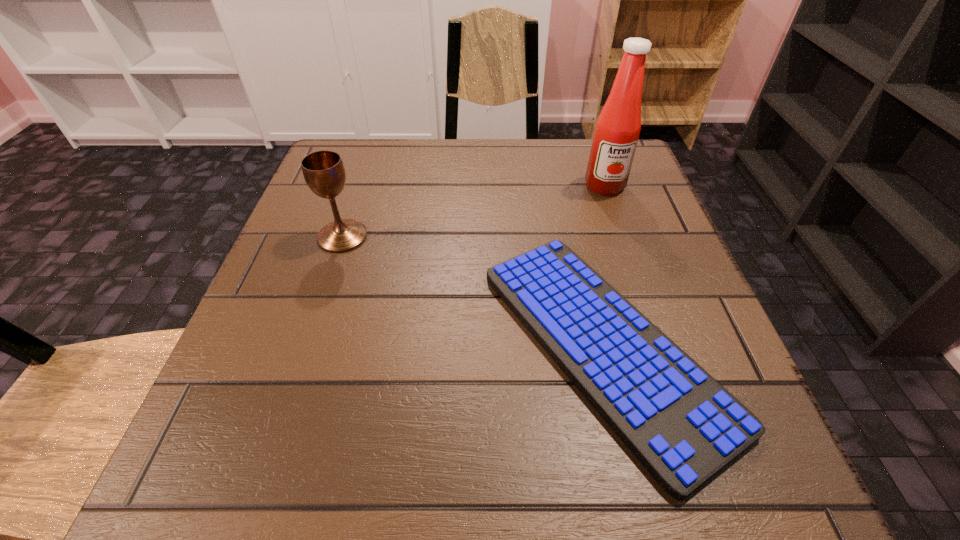
Locate an element on the screen. The image size is (960, 540). the farthest object is located at coordinates (617, 130).

Locate an element on the screen. the tallest object is located at coordinates (617, 130).

This screenshot has height=540, width=960. Identify the location of the leftmost object. (324, 172).

This screenshot has height=540, width=960. I want to click on the second tallest object, so click(x=324, y=172).

Locate an element on the screen. The width and height of the screenshot is (960, 540). computer keyboard is located at coordinates (683, 426).

Identify the location of vacant area situated on the front-facing side of the condiment. The image size is (960, 540). (632, 267).

The width and height of the screenshot is (960, 540). Find the location of `vacant space positioned on the left of the leftmost object`. vacant space positioned on the left of the leftmost object is located at coordinates (287, 237).

Locate an element on the screen. free spot located 0.380m on the back of the shortest object is located at coordinates (556, 144).

This screenshot has width=960, height=540. Identify the location of object that is positioned at the far edge. (617, 130).

At what (x,y) coordinates should I click in order to perform the action: click on object that is at the near edge. Please return your answer as a coordinate pair (x, y). Looking at the image, I should click on (683, 426).